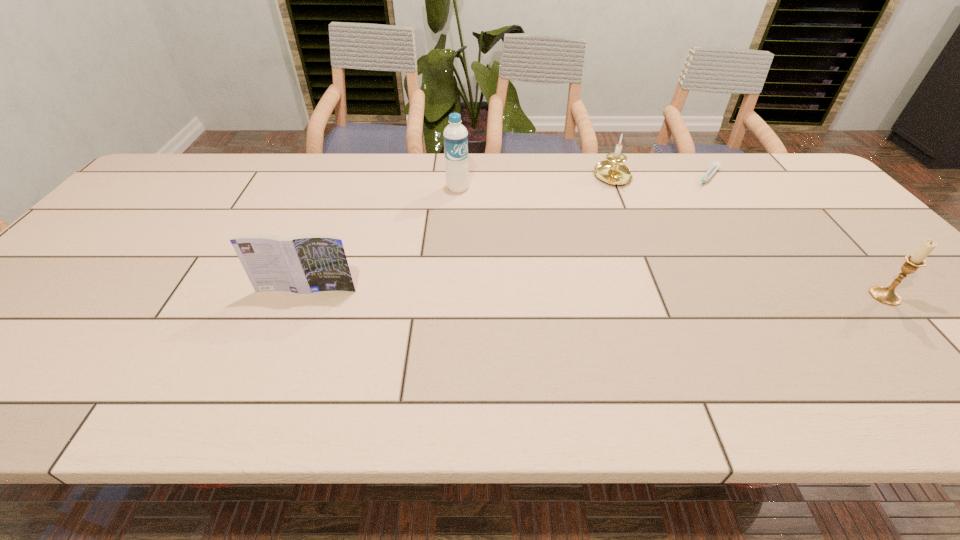
Identify the location of free space on the desktop that is between the book and the nearer candle holder and is positioned on the label of the water bottle. This screenshot has height=540, width=960. (554, 293).

Find the location of a particular element. This screenshot has width=960, height=540. free space on the desktop that is between the book and the rightmost object and is positioned at the needle end of the syringe is located at coordinates (611, 293).

Image resolution: width=960 pixels, height=540 pixels. I want to click on vacant spot on the desktop that is between the book and the nearer candle holder and is positioned on the handle side of the shorter candle holder, so click(674, 294).